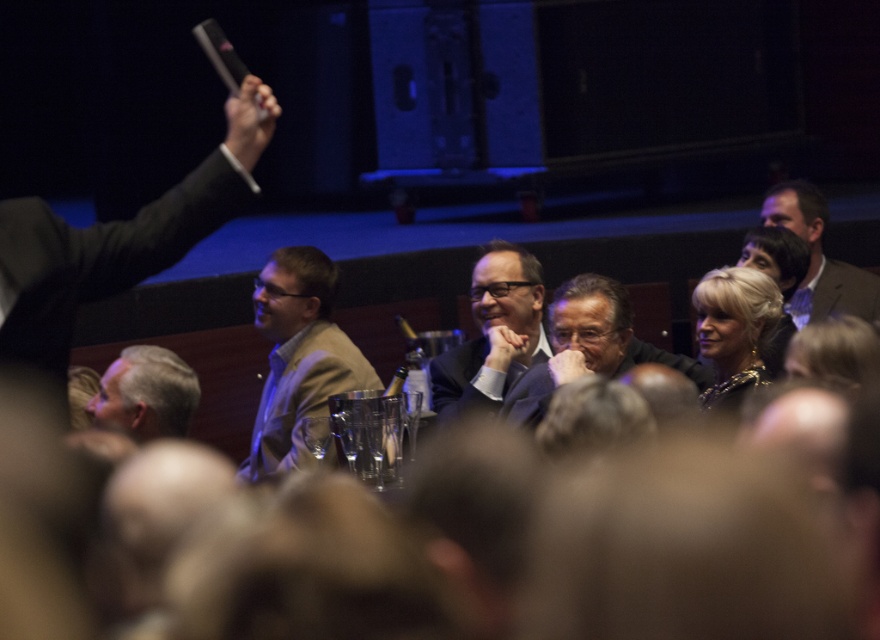
Does matte black suit at left have a smaller size compared to gray fabric suit at lower left?

Incorrect, matte black suit at left is not smaller in size than gray fabric suit at lower left.

The height and width of the screenshot is (640, 880). What do you see at coordinates (116, 243) in the screenshot? I see `matte black suit at left` at bounding box center [116, 243].

This screenshot has height=640, width=880. I want to click on matte black suit at left, so click(x=116, y=243).

Who is lower down, matte black suit at left or dark gray suit at center?

dark gray suit at center is lower down.

Between point (147, 266) and point (583, 284), which one is positioned in front?

Point (147, 266)

Who is more distant from viewer, (30, 205) or (536, 420)?

The point (536, 420) is behind.

Locate an element on the screen. Image resolution: width=880 pixels, height=640 pixels. matte black suit at left is located at coordinates (116, 243).

Which is more to the left, matte black suit at left or shiny gold necklace at center?

From the viewer's perspective, matte black suit at left appears more on the left side.

Does matte black suit at left have a greater width compared to shiny gold necklace at center?

Indeed, matte black suit at left has a greater width compared to shiny gold necklace at center.

The image size is (880, 640). Describe the element at coordinates (116, 243) in the screenshot. I see `matte black suit at left` at that location.

The image size is (880, 640). In order to click on matte black suit at left in this screenshot , I will do `click(116, 243)`.